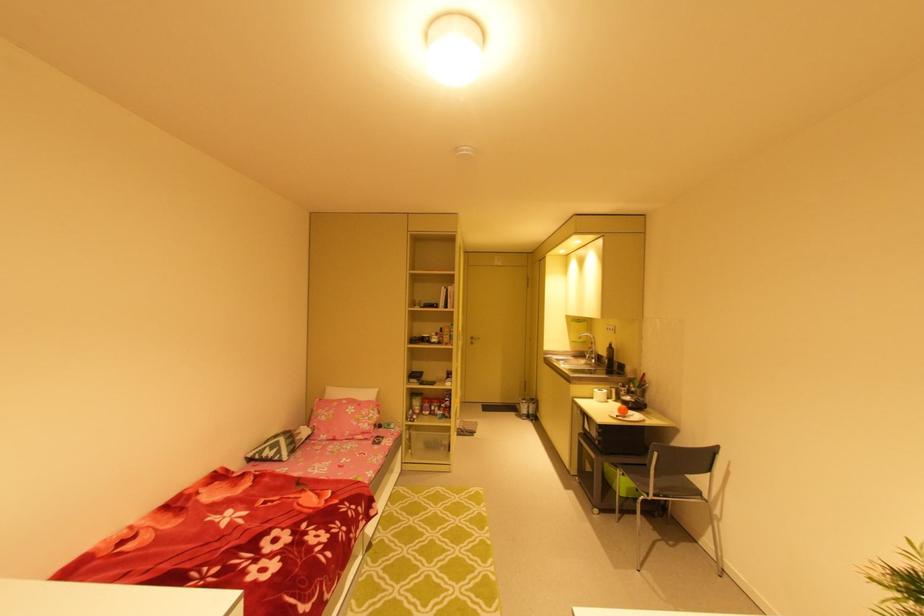
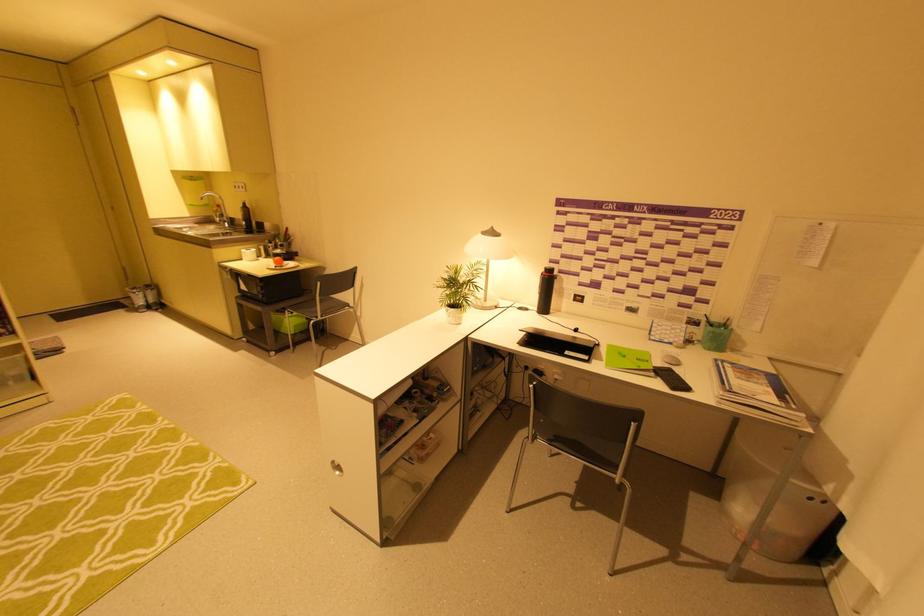
Based on the continuous images, in which direction is the camera rotating?

The camera rotated toward right-down.